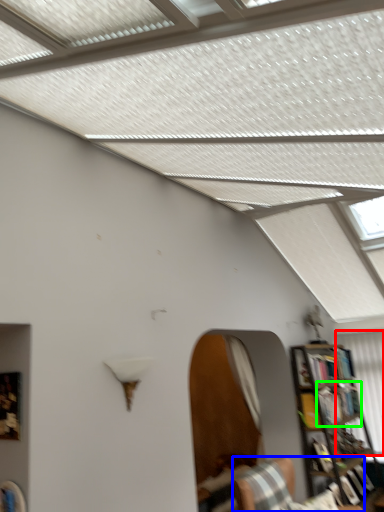
Question: Considering the real-world distances, which object is farthest from curtain (highlighted by a red box)? furniture (highlighted by a blue box) or book (highlighted by a green box)?

Choices:
 (A) furniture
 (B) book

Answer: (A)